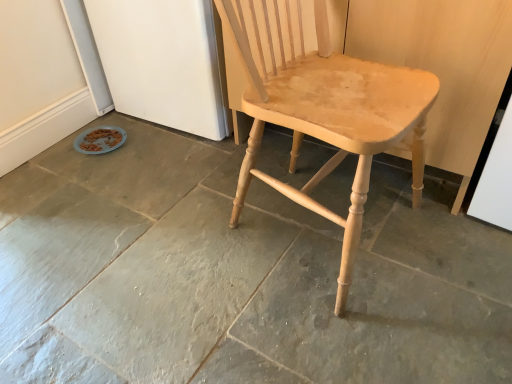
You are a GUI agent. You are given a task and a screenshot of the screen. Output one action in this format:
    pyautogui.click(x=<x>, y=<y>)
    Task: Click on the vacant space in natural wood chair at center (from a real-world perspective)
    
    Given the screenshot: What is the action you would take?
    pos(313,239)